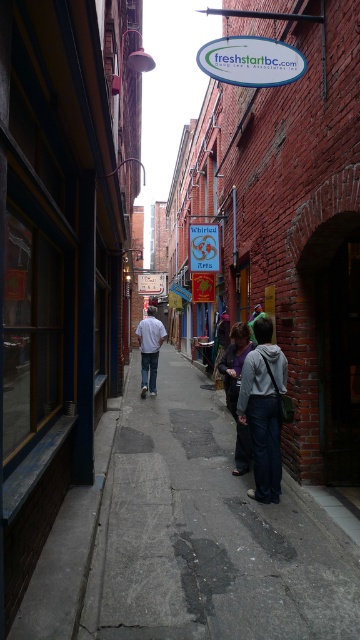
Question: Estimate the real-world distances between objects in this image. Which object is closer to the white cotton shirt at center?

Choices:
 (A) dark gray hoodie at center
 (B) gray fabric jacket at center
 (C) concrete sidewalk at center

Answer: (C)

Question: Can you confirm if concrete sidewalk at center is positioned below white cotton shirt at center?

Choices:
 (A) yes
 (B) no

Answer: (A)

Question: Which of the following is the closest to the observer?

Choices:
 (A) dark gray hoodie at center
 (B) gray fabric jacket at center
 (C) white cotton shirt at center
 (D) concrete sidewalk at center

Answer: (D)

Question: Can you confirm if concrete sidewalk at center is positioned below white cotton shirt at center?

Choices:
 (A) yes
 (B) no

Answer: (A)

Question: Is gray fabric jacket at center bigger than white cotton shirt at center?

Choices:
 (A) yes
 (B) no

Answer: (B)

Question: Which of these objects is positioned farthest from the dark gray hoodie at center?

Choices:
 (A) white cotton shirt at center
 (B) gray fabric jacket at center

Answer: (A)